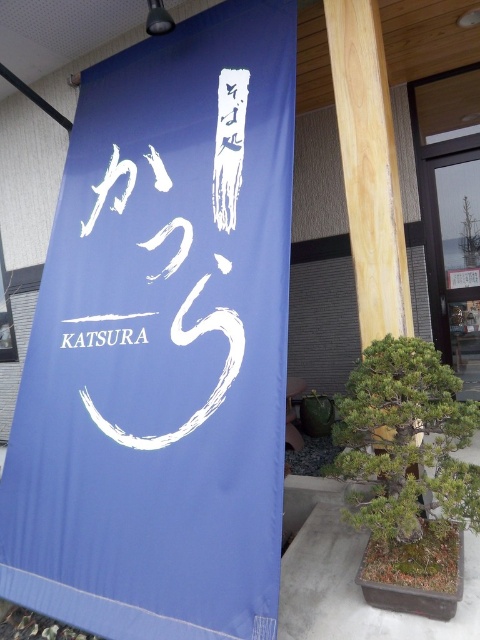
Is green leafy plant at lower right below white paper at center?

Yes.

Is green leafy plant at lower right in front of white paper at center?

Yes, green leafy plant at lower right is closer to the viewer.

Who is more distant from viewer, (x=384, y=355) or (x=110, y=346)?

Positioned behind is point (x=110, y=346).

At what (x,y) coordinates should I click in order to perform the action: click on green leafy plant at lower right. Please return your answer as a coordinate pair (x, y). This screenshot has width=480, height=640. Looking at the image, I should click on (406, 442).

Is blue fabric sign at center wider than white paper at center?

Yes, blue fabric sign at center is wider than white paper at center.

In the scene shown: Between blue fabric sign at center and white paper at center, which one is positioned higher?

blue fabric sign at center

Is point (152, 547) farther from viewer compared to point (96, 344)?

No, (152, 547) is in front of (96, 344).

Locate an element on the screen. Image resolution: width=480 pixels, height=640 pixels. blue fabric sign at center is located at coordinates (163, 342).

Describe the element at coordinates (163, 342) in the screenshot. This screenshot has width=480, height=640. I see `blue fabric sign at center` at that location.

What are the coordinates of `blue fabric sign at center` in the screenshot? It's located at (163, 342).